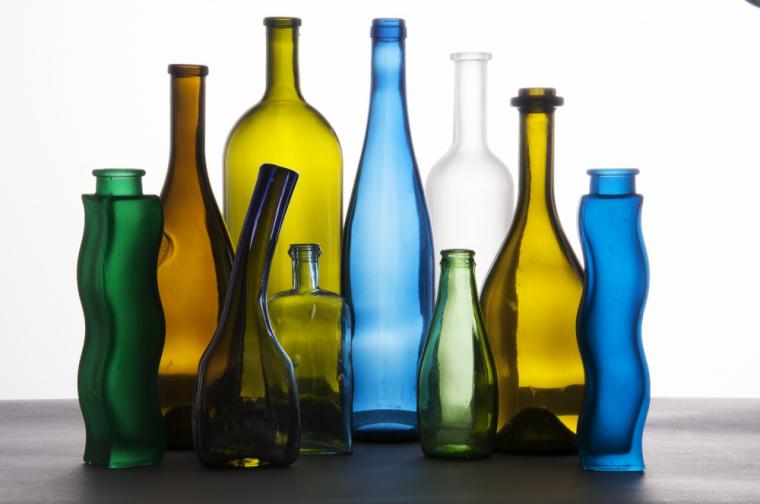
At what (x,y) coordinates should I click in order to perform the action: click on glass bottles. Please return your answer as a coordinate pair (x, y). The height and width of the screenshot is (504, 760). Looking at the image, I should click on (128, 231), (176, 256), (260, 129), (241, 296), (309, 316), (380, 278), (469, 326), (477, 184), (534, 262), (608, 289).